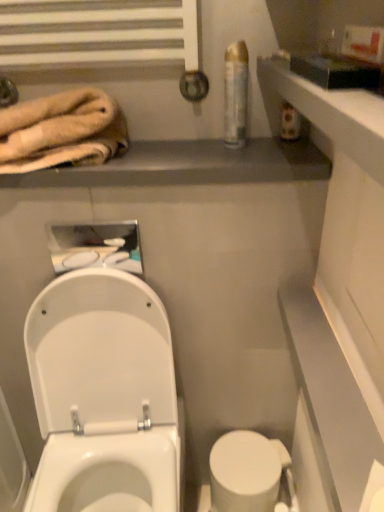
Find the location of a particular element. This screenshot has width=384, height=512. vacant space in front of clear plastic can at upper right is located at coordinates (238, 159).